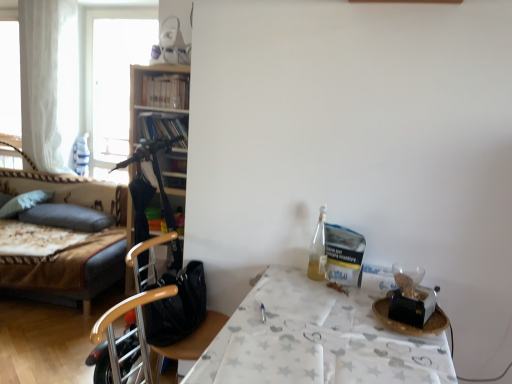
Question: Do you think white paper table at right is within transparent glass window at upper left, or outside of it?

Choices:
 (A) inside
 (B) outside

Answer: (B)

Question: Looking at their shapes, would you say white paper table at right is wider or thinner than transparent glass window at upper left?

Choices:
 (A) wide
 (B) thin

Answer: (A)

Question: Estimate the real-world distances between objects in this image. Which object is farther from the white sheer curtain at left?

Choices:
 (A) wooden chair at center
 (B) velvet-like brown bed at left
 (C) white paper table at right
 (D) dark gray fabric pillow at left, the 1th pillow when ordered from right to left
 (E) transparent glass window at upper left

Answer: (C)

Question: Considering the real-world distances, which object is closest to the wooden chair at center?

Choices:
 (A) white sheer curtain at left
 (B) white paper table at right
 (C) soft gray pillow at left, the first pillow viewed from the left
 (D) velvet-like brown bed at left
 (E) transparent glass window at upper left

Answer: (B)